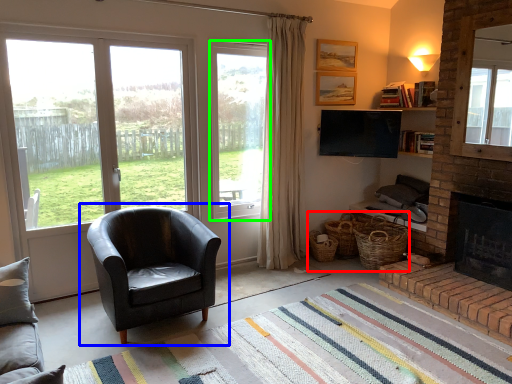
Question: Which object is positioned farthest from basket (highlighted by a red box)? Select from chair (highlighted by a blue box) and window (highlighted by a green box).

Choices:
 (A) chair
 (B) window

Answer: (A)